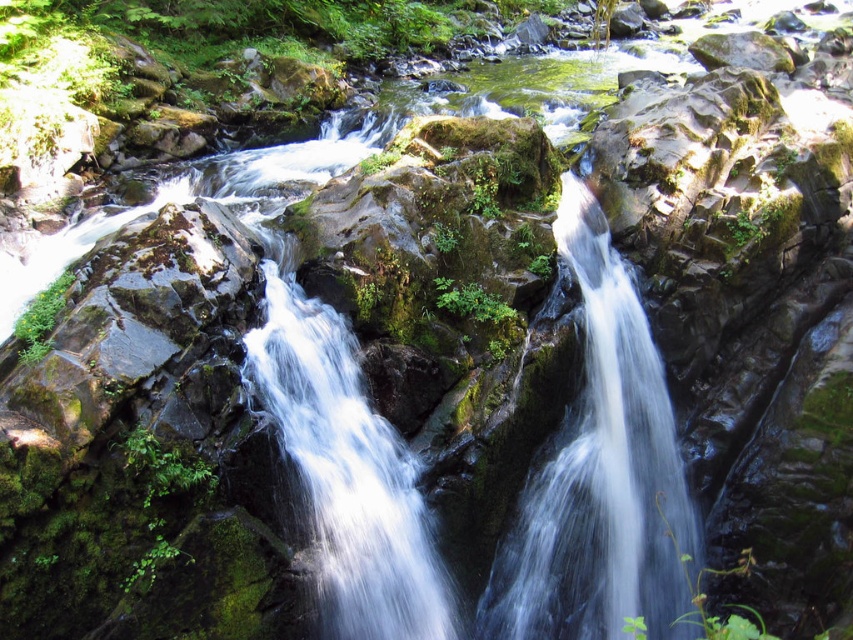
Does translucent glass waterfall at center appear under clear water at center?

Incorrect, translucent glass waterfall at center is not positioned below clear water at center.

Can you confirm if translucent glass waterfall at center is thinner than clear water at center?

In fact, translucent glass waterfall at center might be wider than clear water at center.

Who is more forward, (572,611) or (368,557)?

Point (368,557) is in front.

This screenshot has height=640, width=853. Find the location of `translucent glass waterfall at center`. translucent glass waterfall at center is located at coordinates (599, 476).